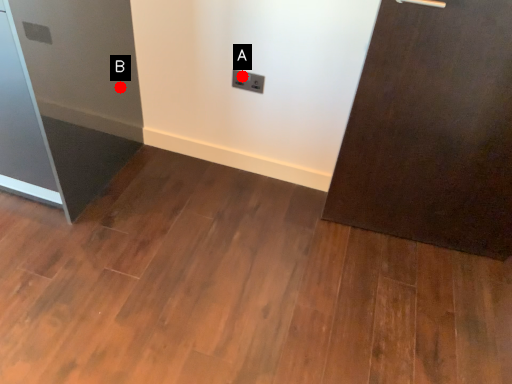
Question: Two points are circled on the image, labeled by A and B beside each circle. Which point is closer to the camera taking this photo?

Choices:
 (A) A is closer
 (B) B is closer

Answer: (A)